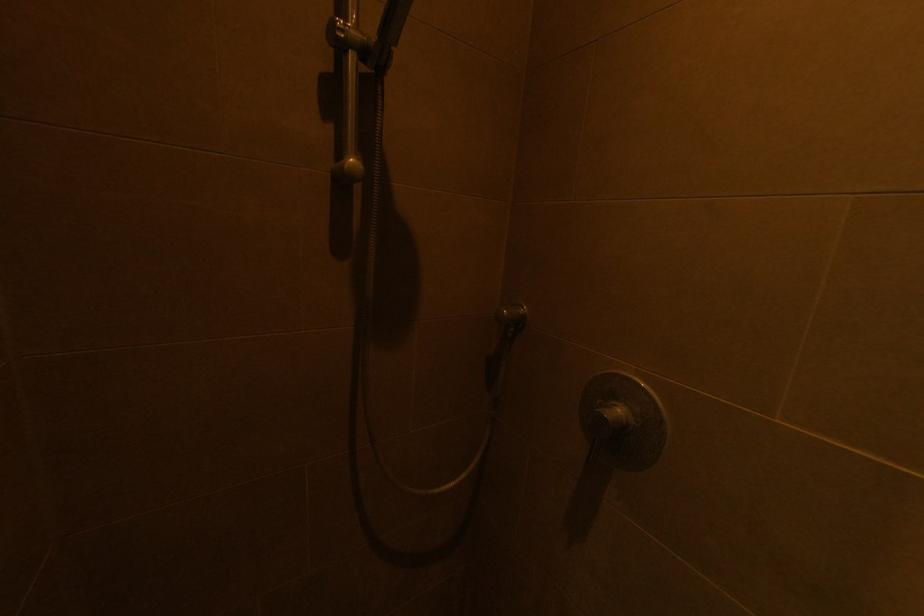
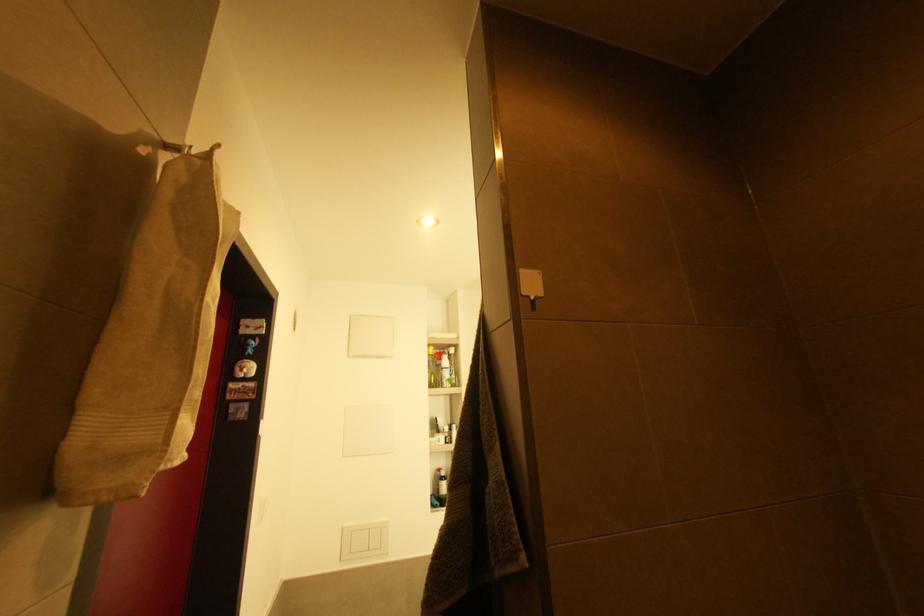
First-person continuous shooting, in which direction is the camera rotating?

The camera rotated toward left-up.